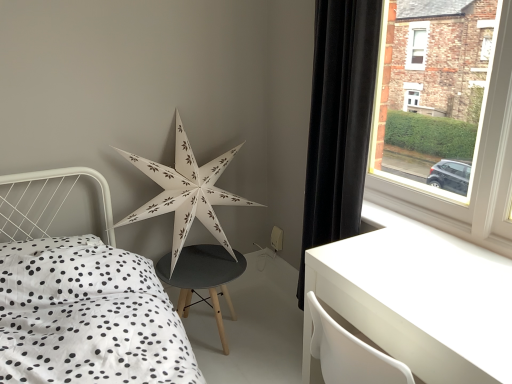
This screenshot has width=512, height=384. In order to click on white smooth window sill at lower right in this screenshot , I will do `click(446, 212)`.

The width and height of the screenshot is (512, 384). Identify the location of white glossy table at lower right. (422, 300).

Considering the points (146, 212) and (327, 114), which point is in front, point (146, 212) or point (327, 114)?

The point (327, 114) is closer to the camera.

Can you tell me how much white paper star at center and black velvet curtain at right differ in facing direction?

87.8 degrees separate the facing orientations of white paper star at center and black velvet curtain at right.

From the image's perspective, who appears lower, white paper star at center or black velvet curtain at right?

From the image's view, white paper star at center is below.

At what (x,y) coordinates should I click in order to perform the action: click on curtain in front of the white paper star at center. Please return your answer as a coordinate pair (x, y). Looking at the image, I should click on (339, 121).

Consider the image. From the image's perspective, between white paper star at center and white smooth window sill at lower right, which one is located above?

white paper star at center appears higher in the image.

Looking at this image, which of these two, white paper star at center or white smooth window sill at lower right, is wider?

With larger width is white paper star at center.

From a real-world perspective, is white paper star at center positioned under white smooth window sill at lower right based on gravity?

Actually, white paper star at center is physically above white smooth window sill at lower right in the real world.

Could you tell me if white smooth window sill at lower right is facing white paper star at center?

No, white smooth window sill at lower right is not turned towards white paper star at center.

Would you say white paper star at center is part of white smooth window sill at lower right's contents?

That's incorrect, white paper star at center is not inside white smooth window sill at lower right.

Is white smooth window sill at lower right smaller than white paper star at center?

Yes.

Can you confirm if white smooth window sill at lower right is positioned to the left of white paper star at center?

No, white smooth window sill at lower right is not to the left of white paper star at center.

Considering the relative positions of white paper star at center and white glossy table at lower right in the image provided, is white paper star at center in front of white glossy table at lower right?

No, it is not.

From the image's perspective, is white paper star at center on white glossy table at lower right?

Yes, from the image's perspective, white paper star at center is over white glossy table at lower right.

Is white paper star at center smaller than white glossy table at lower right?

Incorrect, white paper star at center is not smaller in size than white glossy table at lower right.

Is white glossy table at lower right at the back of white paper star at center?

No.

Is black velvet curtain at right inside the boundaries of white smooth window sill at lower right, or outside?

black velvet curtain at right is outside white smooth window sill at lower right.

Between black velvet curtain at right and white smooth window sill at lower right, which one has less height?

With less height is white smooth window sill at lower right.

Is the position of black velvet curtain at right more distant than that of white smooth window sill at lower right?

Yes, black velvet curtain at right is further from the camera.

Looking at this image, which of these two, black velvet curtain at right or white smooth window sill at lower right, is bigger?

black velvet curtain at right is bigger.

Is black velvet curtain at right to the left or to the right of white paper star at center in the image?

Based on their positions, black velvet curtain at right is located to the right of white paper star at center.

Between point (342, 89) and point (205, 187), which one is positioned behind?

Point (205, 187)

Looking at the image, does black velvet curtain at right seem bigger or smaller compared to white paper star at center?

In the image, black velvet curtain at right appears to be smaller than white paper star at center.

From the image's perspective, is white glossy table at lower right under black velvet curtain at right?

Yes, from the image's perspective, white glossy table at lower right is below black velvet curtain at right.

Does white glossy table at lower right have a greater width compared to black velvet curtain at right?

Yes, white glossy table at lower right is wider than black velvet curtain at right.

From a real-world perspective, between white glossy table at lower right and black velvet curtain at right, who is vertically higher?

In real-world perspective, black velvet curtain at right is above.

Is white glossy table at lower right completely or partially outside of black velvet curtain at right?

white glossy table at lower right lies outside black velvet curtain at right's area.

Find the location of `star lying behind the black velvet curtain at right`. star lying behind the black velvet curtain at right is located at coordinates (186, 193).

The width and height of the screenshot is (512, 384). In the image, there is a white paper star at center. Identify the location of window sill below it (from a real-world perspective). (446, 212).

Based on their spatial positions, is black velvet curtain at right or white paper star at center further from white glossy table at lower right?

white paper star at center lies further to white glossy table at lower right than the other object.

Looking at this image, which object lies further to the anchor point white glossy table at lower right, white paper star at center or black velvet curtain at right?

white paper star at center.

When comparing their distances from white smooth window sill at lower right, does white glossy table at lower right or white paper star at center seem closer?

white glossy table at lower right lies closer to white smooth window sill at lower right than the other object.

Based on their spatial positions, is white paper star at center or white smooth window sill at lower right further from black velvet curtain at right?

white paper star at center.

When comparing their distances from white smooth window sill at lower right, does black velvet curtain at right or white paper star at center seem closer?

black velvet curtain at right lies closer to white smooth window sill at lower right than the other object.

Considering their positions, is white smooth window sill at lower right positioned further to black velvet curtain at right than white glossy table at lower right?

Among the two, white glossy table at lower right is located further to black velvet curtain at right.

Which object lies further to the anchor point white paper star at center, white glossy table at lower right or white smooth window sill at lower right?

The object further to white paper star at center is white glossy table at lower right.

Which object lies nearer to the anchor point white smooth window sill at lower right, white paper star at center or black velvet curtain at right?

Among the two, black velvet curtain at right is located nearer to white smooth window sill at lower right.

Locate an element on the screen. The image size is (512, 384). curtain located between white paper star at center and white smooth window sill at lower right in the left-right direction is located at coordinates (339, 121).

What are the coordinates of `curtain between white paper star at center and white glossy table at lower right from left to right` in the screenshot? It's located at (339, 121).

This screenshot has height=384, width=512. What are the coordinates of `window sill positioned between white glossy table at lower right and black velvet curtain at right from near to far` in the screenshot? It's located at (446, 212).

Locate an element on the screen. The height and width of the screenshot is (384, 512). table located between white paper star at center and white smooth window sill at lower right in the left-right direction is located at coordinates (422, 300).